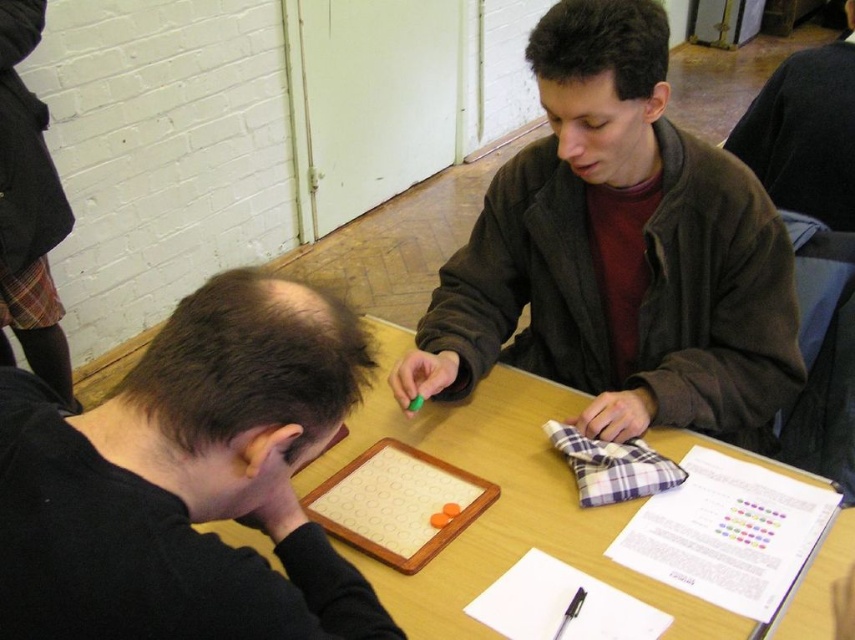
You are standing at the edge of the table and want to place a small item on the wooden table at center. Considering the position of the black matte shirt at lower left, where should you aim to place the item so it doesn

Since the black matte shirt at lower left is to the left of the wooden table at center, you should aim to place the item to the right side of the black matte shirt at lower left to ensure it lands on the wooden table at center.

Consider the image. You are trying to place a new game piece on the table between the dark brown jacket at center and the wooden table at center. Which object should you place it closer to to ensure it fits better?

The dark brown jacket at center occupies less space than the wooden table at center, so placing the game piece closer to the dark brown jacket at center would allow more space for it to fit better.